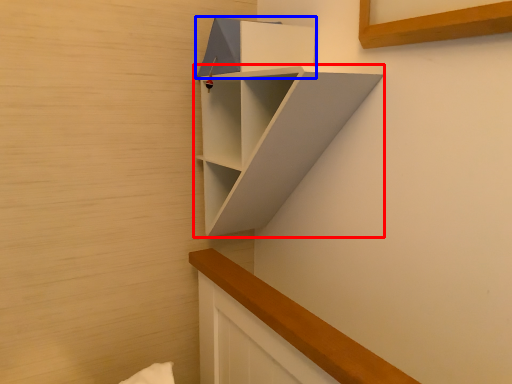
Question: Which object is closer to the camera taking this photo, shelf (highlighted by a red box) or cabinet (highlighted by a blue box)?

Choices:
 (A) shelf
 (B) cabinet

Answer: (A)